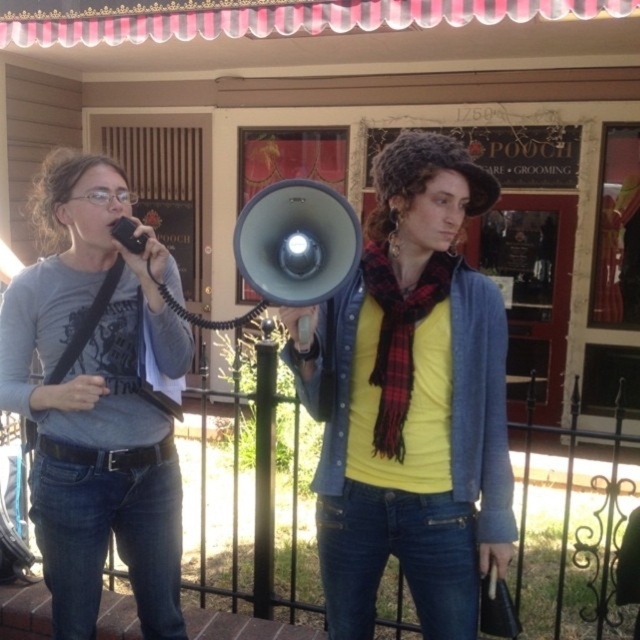
Is matte black megaphone at center thinner than matte gray shirt at left?

In fact, matte black megaphone at center might be wider than matte gray shirt at left.

Is point (477, 490) closer to camera compared to point (90, 276)?

Yes, it is in front of point (90, 276).

Which is behind, point (369, 620) or point (42, 214)?

The point (42, 214) is more distant.

I want to click on matte black megaphone at center, so click(417, 404).

Can you confirm if matte black megaphone at center is positioned to the right of matte gray megaphone at center?

Yes, matte black megaphone at center is to the right of matte gray megaphone at center.

Which is above, matte black megaphone at center or matte gray megaphone at center?

matte gray megaphone at center is above.

Is point (387, 480) positioned after point (310, 240)?

Yes, it is behind point (310, 240).

At what (x,y) coordinates should I click in order to perform the action: click on matte black megaphone at center. Please return your answer as a coordinate pair (x, y). The width and height of the screenshot is (640, 640). Looking at the image, I should click on (417, 404).

Does matte gray shirt at left have a lesser width compared to matte gray megaphone at center?

Incorrect, matte gray shirt at left's width is not less than matte gray megaphone at center's.

Is matte gray shirt at left shorter than matte gray megaphone at center?

No.

Where is `matte gray shirt at left`? The width and height of the screenshot is (640, 640). matte gray shirt at left is located at coordinates (99, 397).